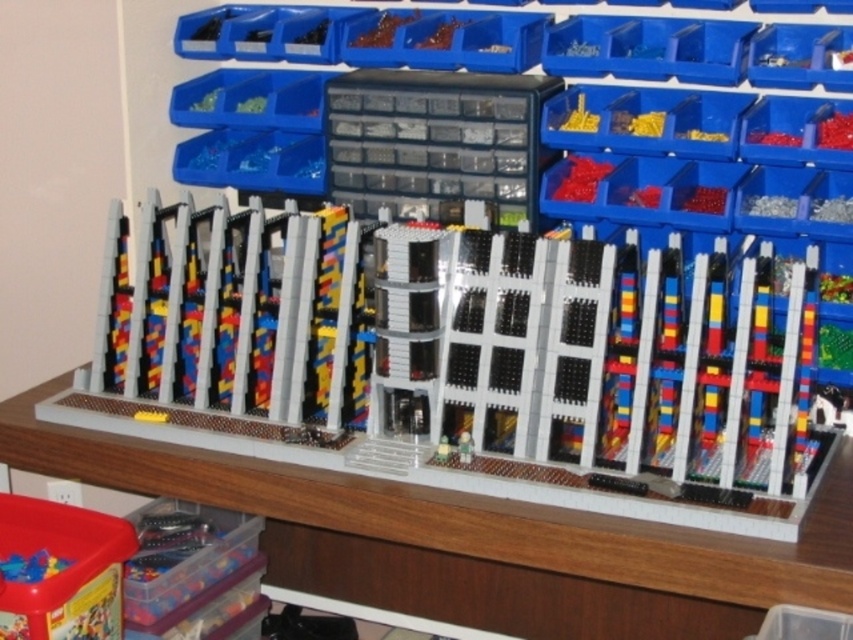
Is brick-patterned lego building at center shorter than wooden table at center?

In fact, brick-patterned lego building at center may be taller than wooden table at center.

The image size is (853, 640). What do you see at coordinates (465, 364) in the screenshot?
I see `brick-patterned lego building at center` at bounding box center [465, 364].

In order to click on brick-patterned lego building at center in this screenshot , I will do `click(465, 364)`.

I want to click on brick-patterned lego building at center, so click(465, 364).